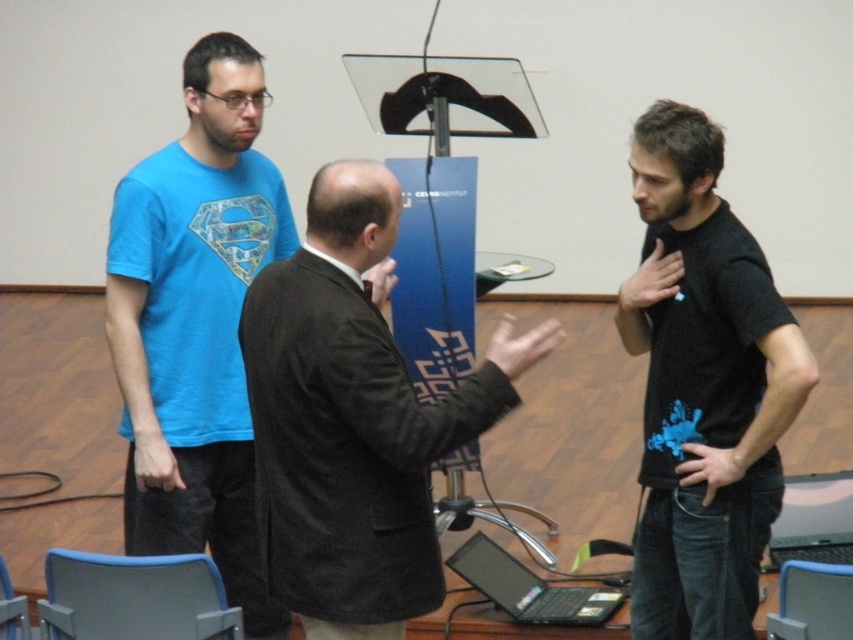
You are standing in the conference room and see the man in the dark suit jacket and light shirt. There is a point at coordinates (196, 323). Where is this point located?

The point at coordinates (196, 323) is on the blue matte t shirt at left.

Based on the photo, you are a photographer setting up for a group photo in the conference room. You need to place a new laptop between the black glossy laptop at lower center and the black plastic laptop at lower right. Where should you position it vertically relative to both?

The black glossy laptop at lower center is below the black plastic laptop at lower right, so to place the new laptop between them, position it vertically between the lower center and lower right positions, ensuring it is above the black glossy laptop at lower center and below the black plastic laptop at lower right.